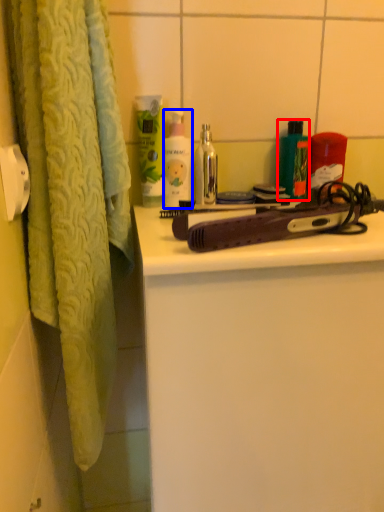
Question: Which point is closer to the camera, product (highlighted by a red box) or cleaning product (highlighted by a blue box)?

Choices:
 (A) product
 (B) cleaning product

Answer: (B)